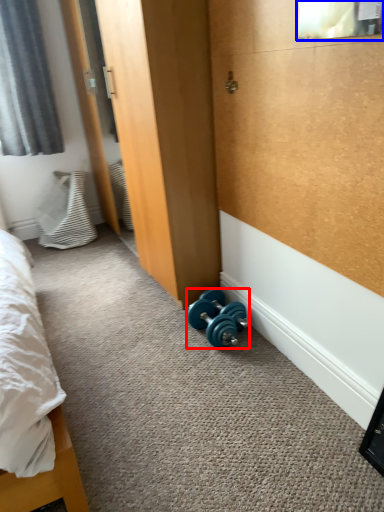
Question: Which of the following is the closest to the observer, dumbbell (highlighted by a red box) or window screen (highlighted by a blue box)?

Choices:
 (A) dumbbell
 (B) window screen

Answer: (B)